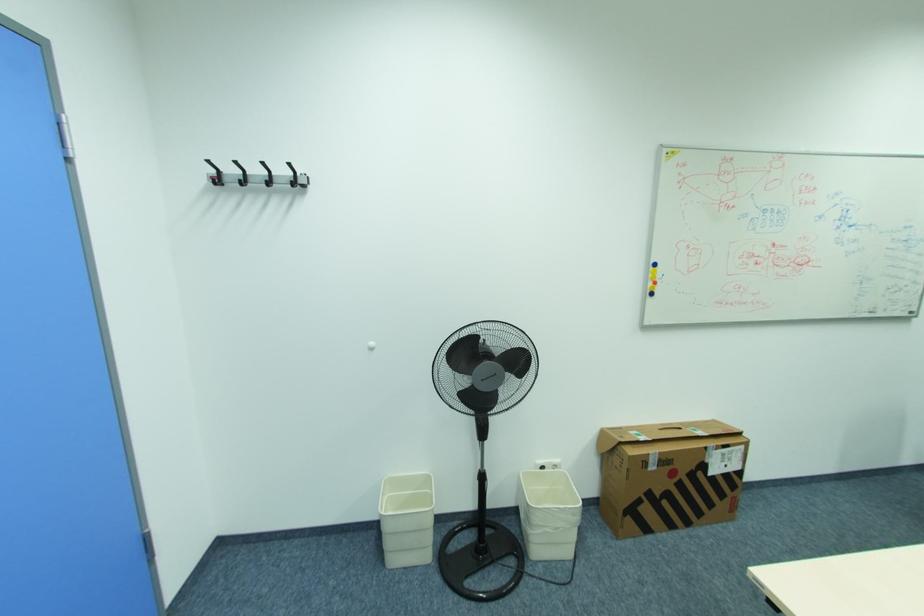
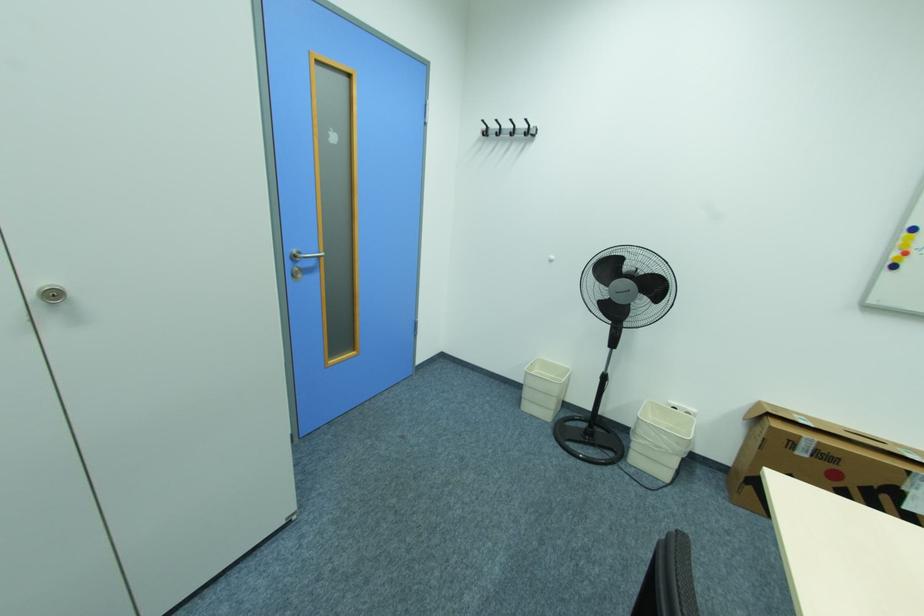
Find the pixel in the second image that matches the point at 661,284 in the first image.

(910, 253)